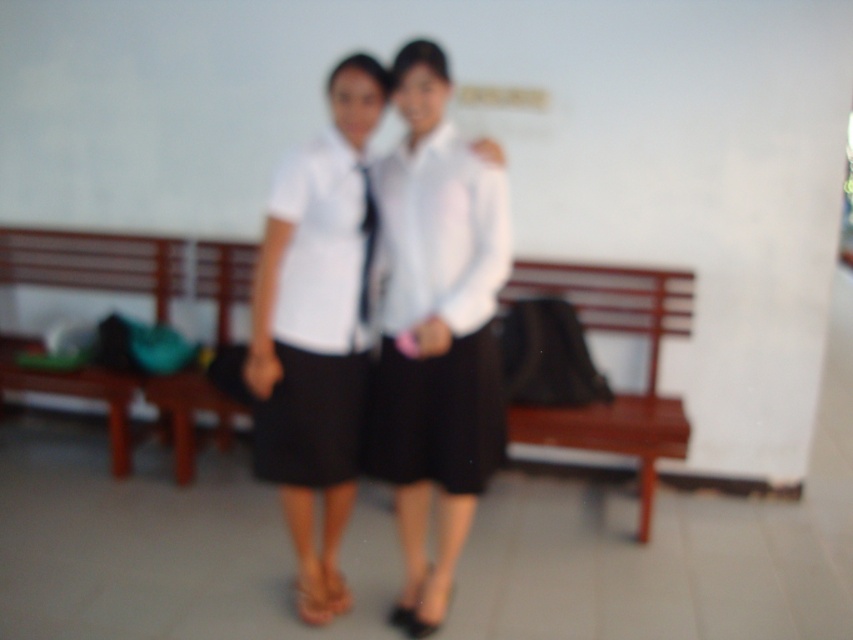
Does white matte shirt at center appear on the right side of white matte uniform skirt at center?

Correct, you'll find white matte shirt at center to the right of white matte uniform skirt at center.

What are the coordinates of `white matte shirt at center` in the screenshot? It's located at (438, 316).

Is point (373, 467) closer to viewer compared to point (294, 365)?

No, (373, 467) is further to viewer.

You are a GUI agent. You are given a task and a screenshot of the screen. Output one action in this format:
    pyautogui.click(x=<x>, y=<y>)
    Task: Click on the white matte shirt at center
    This screenshot has height=640, width=853.
    Given the screenshot: What is the action you would take?
    pyautogui.click(x=438, y=316)

Is wooden bench at center bigger than white smooth shirt at center?

No.

Does wooden bench at center have a lesser height compared to white smooth shirt at center?

Correct, wooden bench at center is not as tall as white smooth shirt at center.

Locate an element on the screen. The image size is (853, 640). wooden bench at center is located at coordinates (619, 394).

Can you confirm if white smooth shirt at center is bigger than black satin tie at center?

Correct, white smooth shirt at center is larger in size than black satin tie at center.

Is point (334, 456) farther from viewer compared to point (369, 244)?

Yes, point (334, 456) is farther from viewer.

Where is `white smooth shirt at center`? The width and height of the screenshot is (853, 640). white smooth shirt at center is located at coordinates (309, 240).